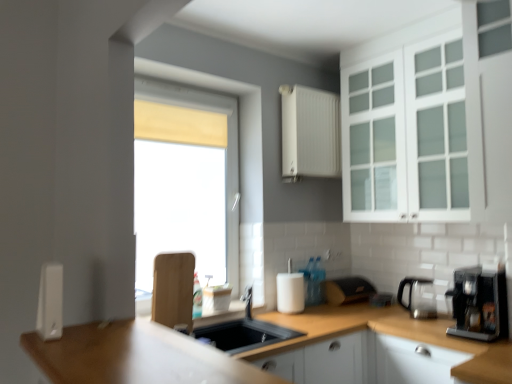
Question: Is satin silver coffee machine at right, acting as the 2th coffee machine starting from the front, wider than white matte cabinet at lower right, the 3th cabinetry from the top?

Choices:
 (A) yes
 (B) no

Answer: (B)

Question: Is satin silver coffee machine at right, acting as the 2th coffee machine starting from the front, turned away from white matte cabinet at lower right, the 3th cabinetry from the top?

Choices:
 (A) no
 (B) yes

Answer: (A)

Question: Is satin silver coffee machine at right, the 1th coffee machine from the back, not close to white matte cabinet at lower right, the 3th cabinetry from the top?

Choices:
 (A) yes
 (B) no

Answer: (B)

Question: Does satin silver coffee machine at right, acting as the 2th coffee machine starting from the front, turn towards white matte cabinet at lower right, positioned as the 1th cabinetry in bottom-to-top order?

Choices:
 (A) no
 (B) yes

Answer: (A)

Question: Can you confirm if satin silver coffee machine at right, acting as the 2th coffee machine starting from the front, is shorter than white matte cabinet at lower right, the 3th cabinetry from the top?

Choices:
 (A) no
 (B) yes

Answer: (A)

Question: Considering the relative positions of matte black toaster at center, which appears as the 2th appliance when viewed from the front, and white plastic soap dispenser at left, the first appliance viewed from the front, in the image provided, is matte black toaster at center, which appears as the 2th appliance when viewed from the front, to the left or to the right of white plastic soap dispenser at left, the first appliance viewed from the front,?

Choices:
 (A) left
 (B) right

Answer: (B)

Question: From a real-world perspective, is matte black toaster at center, which is the first appliance from right to left, physically located above or below white plastic soap dispenser at left, the 1th appliance when ordered from top to bottom?

Choices:
 (A) above
 (B) below

Answer: (B)

Question: Looking at their shapes, would you say matte black toaster at center, which appears as the 2th appliance when viewed from the front, is wider or thinner than white plastic soap dispenser at left, which is the second appliance in bottom-to-top order?

Choices:
 (A) wide
 (B) thin

Answer: (A)

Question: In the image, is matte black toaster at center, which is the first appliance from right to left, positioned in front of or behind white plastic soap dispenser at left, which ranks as the first appliance in left-to-right order?

Choices:
 (A) behind
 (B) front

Answer: (A)

Question: Would you say white matte cabinet at lower right, positioned as the 1th cabinetry in bottom-to-top order, is to the left or to the right of satin silver coffee machine at right, acting as the 2th coffee machine starting from the front, in the picture?

Choices:
 (A) right
 (B) left

Answer: (B)

Question: Is white matte cabinet at lower right, the 3th cabinetry from the top, in front of or behind satin silver coffee machine at right, acting as the 2th coffee machine starting from the front, in the image?

Choices:
 (A) front
 (B) behind

Answer: (A)

Question: Looking at their shapes, would you say white matte cabinet at lower right, positioned as the 1th cabinetry in bottom-to-top order, is wider or thinner than satin silver coffee machine at right, acting as the 2th coffee machine starting from the front?

Choices:
 (A) thin
 (B) wide

Answer: (B)

Question: From a real-world perspective, is white matte cabinet at lower right, the 3th cabinetry from the top, above or below satin silver coffee machine at right, the 1th coffee machine from the back?

Choices:
 (A) below
 (B) above

Answer: (A)

Question: In the image, is black plastic coffee machine at right, placed as the 2th coffee machine when sorted from back to front, on the left side or the right side of white matte cabinet at upper center, marked as the 1th cabinetry in a top-to-bottom arrangement?

Choices:
 (A) left
 (B) right

Answer: (B)

Question: From the image's perspective, is black plastic coffee machine at right, placed as the 2th coffee machine when sorted from back to front, located above or below white matte cabinet at upper center, which is counted as the third cabinetry, starting from the bottom?

Choices:
 (A) above
 (B) below

Answer: (B)